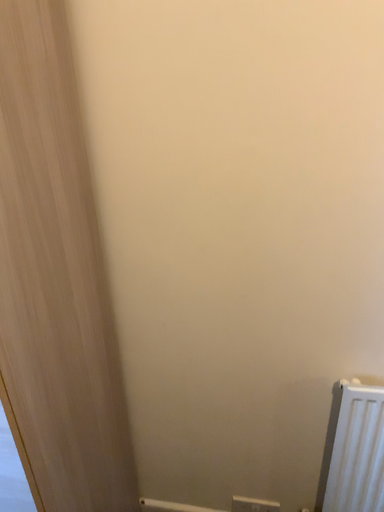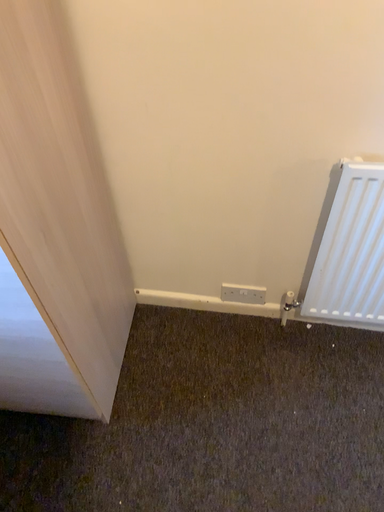
Question: Which way did the camera rotate in the video?

Choices:
 (A) rotated upward
 (B) rotated downward

Answer: (B)